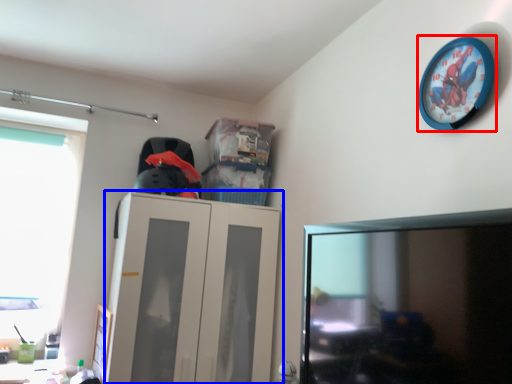
Question: Which point is further to the camera, wall clock (highlighted by a red box) or cabinetry (highlighted by a blue box)?

Choices:
 (A) wall clock
 (B) cabinetry

Answer: (B)